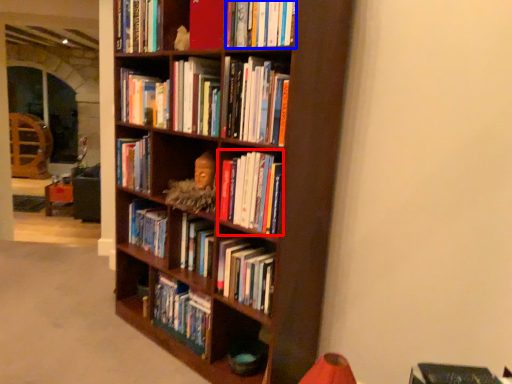
Question: Which point is further to the camera, book (highlighted by a red box) or book (highlighted by a blue box)?

Choices:
 (A) book
 (B) book

Answer: (A)